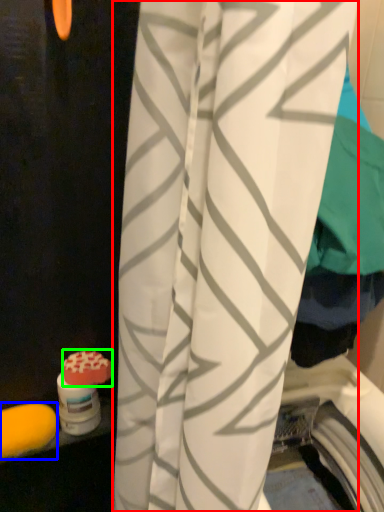
Question: Which object is the farthest from curtain (highlighted by a red box)? Choose among these: soap (highlighted by a blue box) or soap (highlighted by a green box).

Choices:
 (A) soap
 (B) soap

Answer: (A)